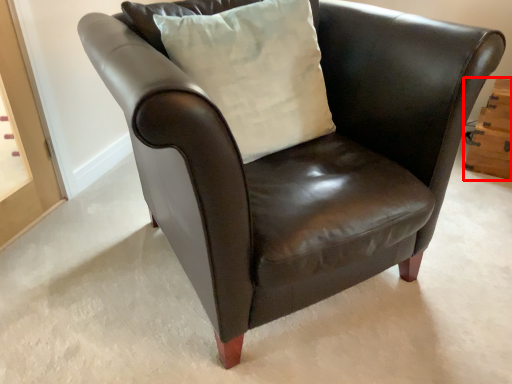
Question: From the image's perspective, what is the correct spatial positioning of drawer (annotated by the red box) in reference to pillow?

Choices:
 (A) above
 (B) below

Answer: (B)